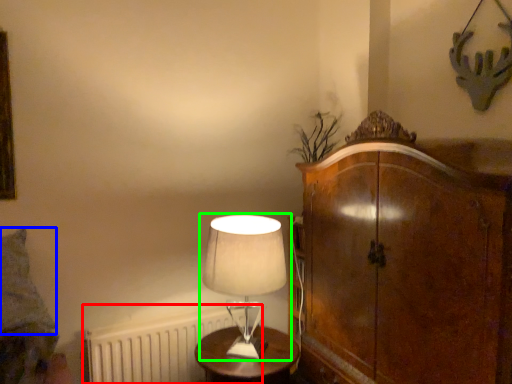
Question: Which object is the closest to the radiator (highlighted by a red box)? Choose among these: pillow (highlighted by a blue box) or lamp (highlighted by a green box).

Choices:
 (A) pillow
 (B) lamp

Answer: (A)